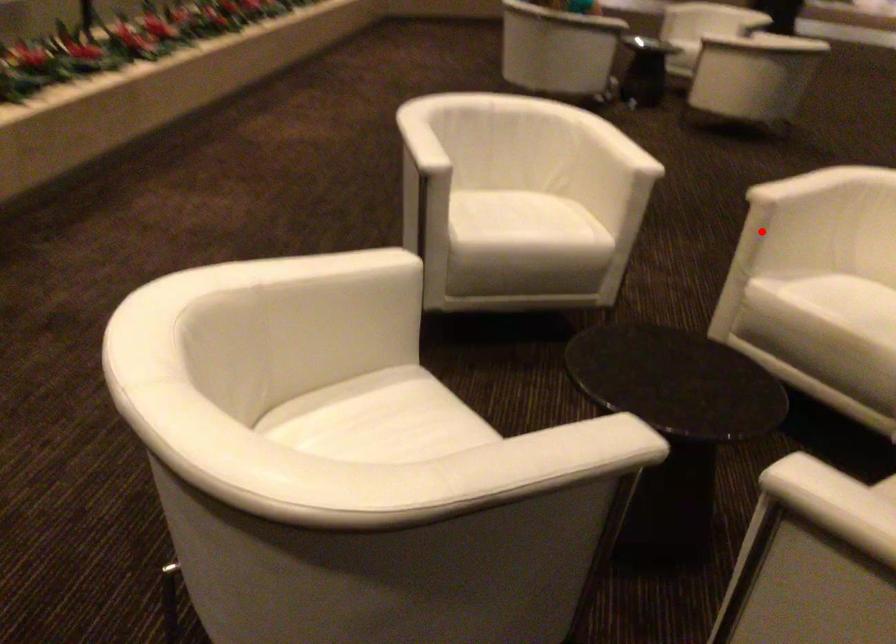
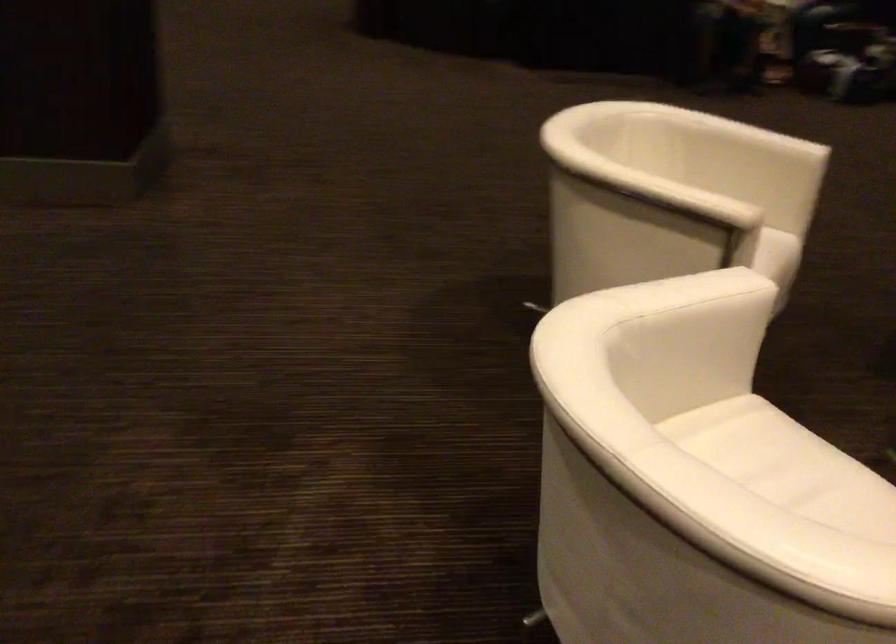
Question: I am providing you with two images of the same scene from different viewpoints. Image1 has a red point marked. In image2, the corresponding 3D location appears at what relative position? Reply with the corresponding letter.

Choices:
 (A) Closer
 (B) Farther

Answer: (A)